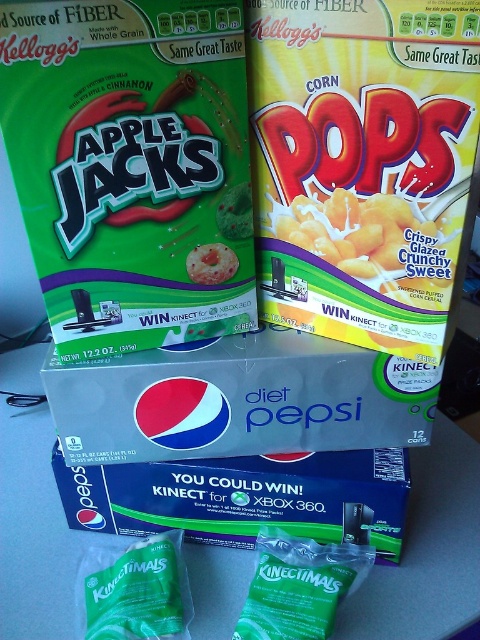
Can you confirm if blue cardboard pepsi box at center is positioned above green matte kinectimals at center?

Indeed, blue cardboard pepsi box at center is positioned over green matte kinectimals at center.

Between blue cardboard pepsi box at center and green matte kinectimals at center, which one has less height?

green matte kinectimals at center

Identify the location of blue cardboard pepsi box at center. The width and height of the screenshot is (480, 640). (245, 497).

Which is more to the right, blue cardboard pepsi box at center or smooth plastic apple at center?

blue cardboard pepsi box at center is more to the right.

Who is taller, blue cardboard pepsi box at center or smooth plastic apple at center?

blue cardboard pepsi box at center is taller.

In order to click on blue cardboard pepsi box at center in this screenshot , I will do `click(245, 497)`.

Can you confirm if yellow paper corn pops at upper right is smaller than green matte kinectimals at center?

No.

The width and height of the screenshot is (480, 640). I want to click on yellow paper corn pops at upper right, so click(364, 164).